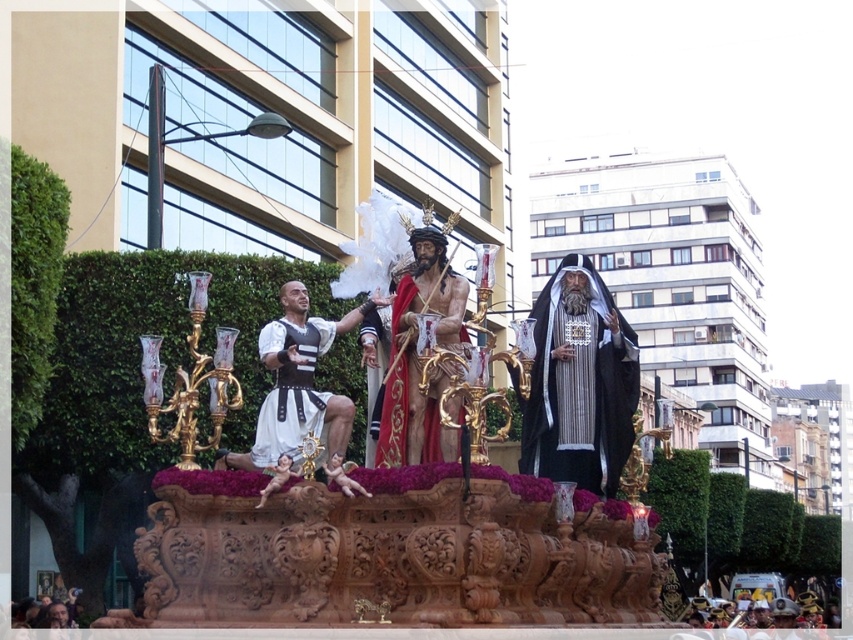
Is wooden carved figure at center wider than smooth flesh cherub at center?

Incorrect, wooden carved figure at center's width does not surpass smooth flesh cherub at center's.

Describe the element at coordinates (390, 416) in the screenshot. I see `wooden carved figure at center` at that location.

Locate an element on the screen. wooden carved figure at center is located at coordinates (390, 416).

Does black silk robe at center appear under white leather tunic at center?

No.

Find the location of `black silk robe at center`. black silk robe at center is located at coordinates click(579, 381).

Is point (308, 419) positioned in front of point (375, 460)?

That is True.

Between point (323, 444) and point (428, 454), which one is positioned behind?

The point (428, 454) is behind.

The height and width of the screenshot is (640, 853). Identify the location of white matte fabric at center. (299, 381).